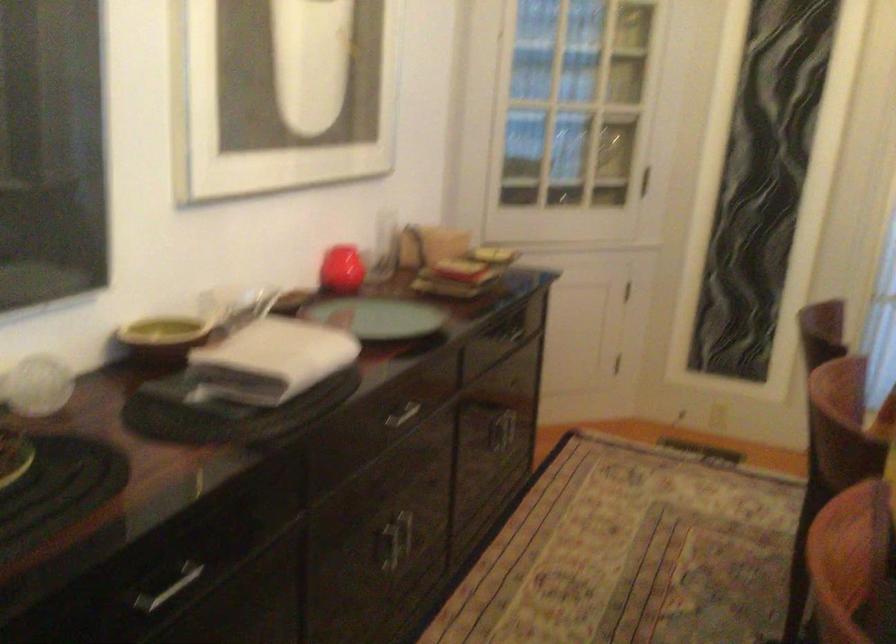
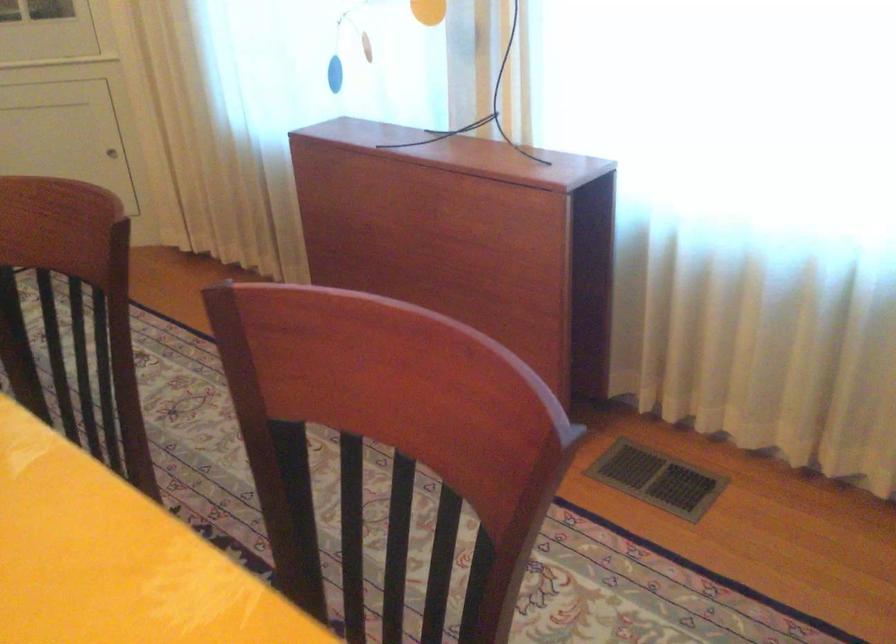
Based on the continuous images, in which direction is the camera rotating?

The camera's rotation is toward right-down.